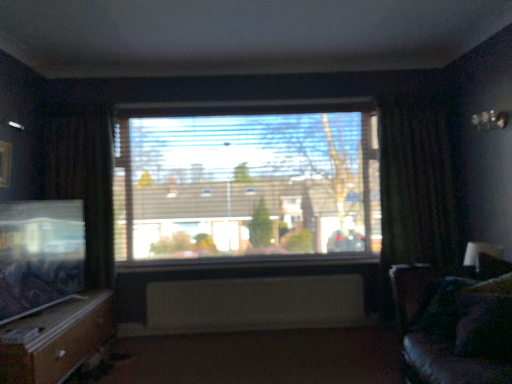
Where is `vacant space situated above white painted wood at center (from a real-world perspective)`? vacant space situated above white painted wood at center (from a real-world perspective) is located at coordinates click(236, 268).